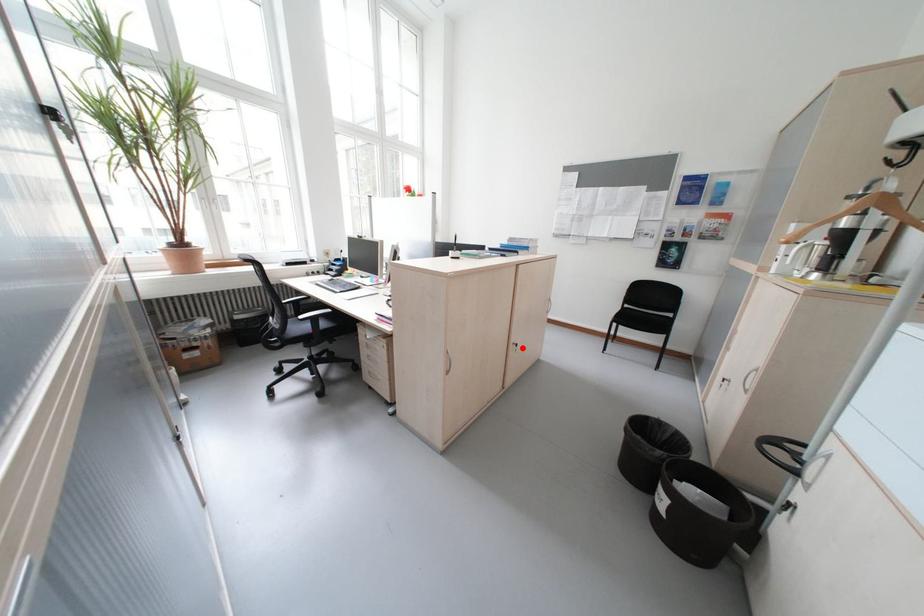
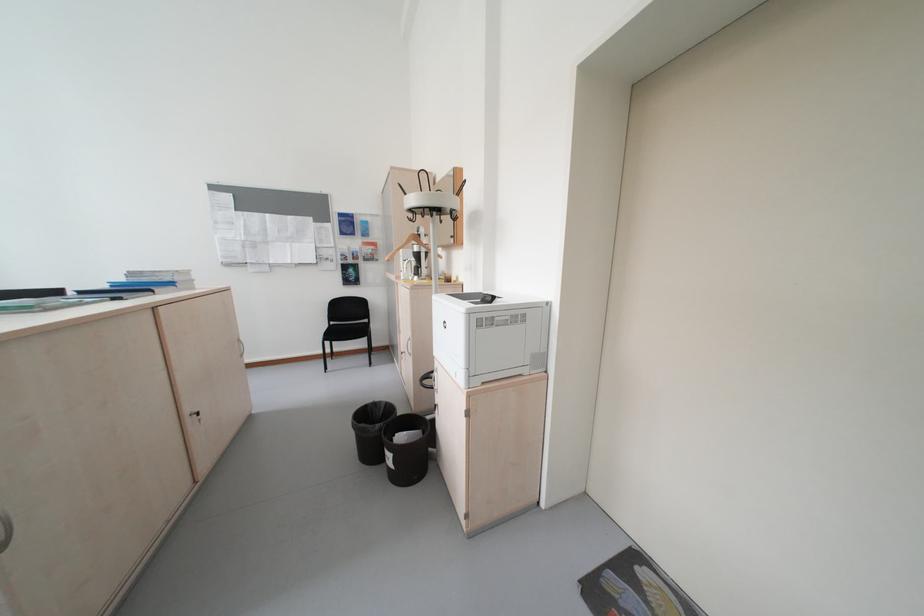
Locate, in the second image, the point that corresponds to the highlighted location in the first image.

(200, 421)